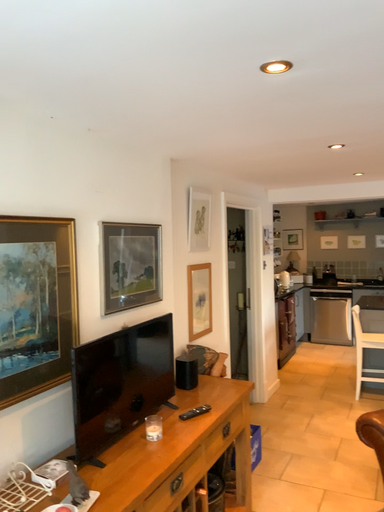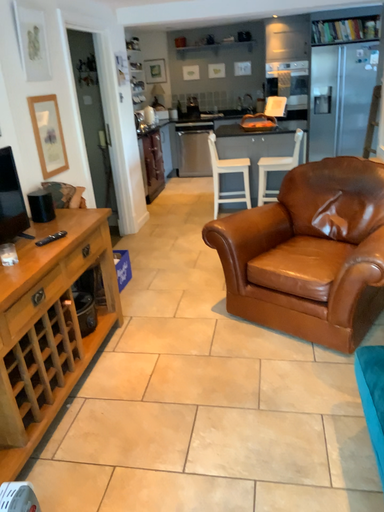
Question: How did the camera likely rotate when shooting the video?

Choices:
 (A) rotated right
 (B) rotated left

Answer: (A)